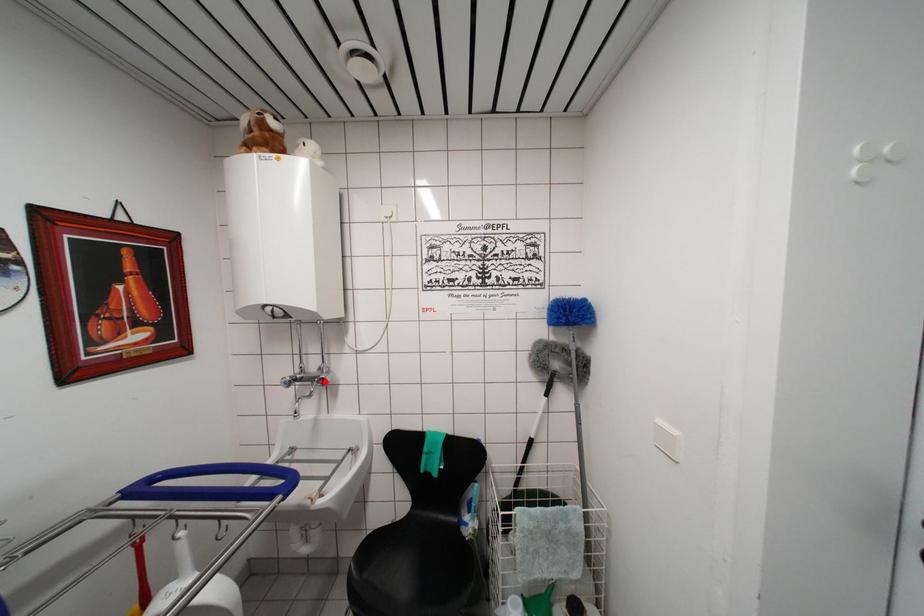
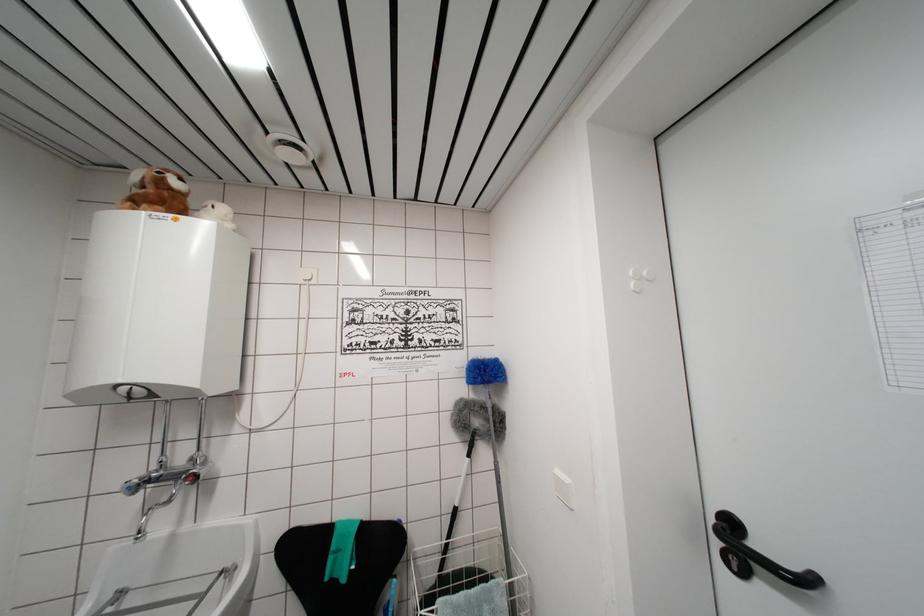
Locate, in the second image, the point that corresponds to the highlighted location in the first image.

(197, 476)